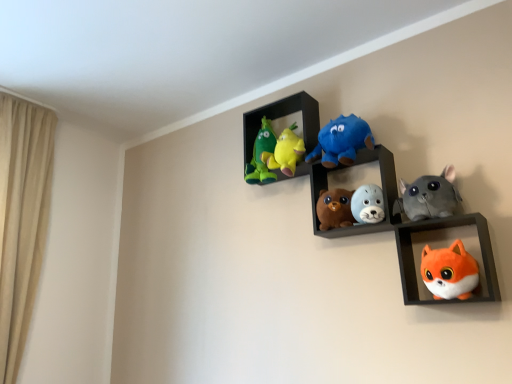
Question: Does fluffy gray seal at center, the 3th toy positioned from the right, appear on the left side of soft plush toys at center, arranged as the second shelf when viewed from the front?

Choices:
 (A) no
 (B) yes

Answer: (A)

Question: Can we say fluffy gray seal at center, the 3th toy positioned from the right, lies outside soft plush toys at center, arranged as the second shelf when viewed from the front?

Choices:
 (A) no
 (B) yes

Answer: (A)

Question: Does fluffy gray seal at center, the 3th toy positioned from the right, have a greater height compared to soft plush toys at center, which appears as the 1th shelf when viewed from the back?

Choices:
 (A) no
 (B) yes

Answer: (A)

Question: Would you say soft plush toys at center, which appears as the 1th shelf when viewed from the back, is part of fluffy gray seal at center, placed as the fourth toy when sorted from left to right,'s contents?

Choices:
 (A) no
 (B) yes

Answer: (A)

Question: Is fluffy gray seal at center, the 3th toy positioned from the right, at the right side of soft plush toys at center, which appears as the 1th shelf when viewed from the back?

Choices:
 (A) no
 (B) yes

Answer: (B)

Question: Is fluffy gray seal at center, the 3th toy positioned from the right, far from soft plush toys at center, arranged as the second shelf when viewed from the front?

Choices:
 (A) yes
 (B) no

Answer: (B)

Question: Is velvet plush toys at upper center placed right next to fluffy gray seal at center, placed as the fourth toy when sorted from left to right?

Choices:
 (A) no
 (B) yes

Answer: (A)

Question: Does velvet plush toys at upper center come in front of fluffy gray seal at center, placed as the fourth toy when sorted from left to right?

Choices:
 (A) yes
 (B) no

Answer: (B)

Question: From a real-world perspective, is velvet plush toys at upper center on top of fluffy gray seal at center, the 3th toy positioned from the right?

Choices:
 (A) yes
 (B) no

Answer: (A)

Question: Can you confirm if velvet plush toys at upper center is taller than fluffy gray seal at center, placed as the fourth toy when sorted from left to right?

Choices:
 (A) yes
 (B) no

Answer: (A)

Question: Is velvet plush toys at upper center not near fluffy gray seal at center, placed as the fourth toy when sorted from left to right?

Choices:
 (A) no
 (B) yes

Answer: (A)

Question: From the image's perspective, is velvet plush toys at upper center above fluffy gray seal at center, placed as the fourth toy when sorted from left to right?

Choices:
 (A) no
 (B) yes

Answer: (B)

Question: Can you confirm if soft plush toys at center, which appears as the 1th shelf when viewed from the back, is taller than fluffy gray seal at center, placed as the fourth toy when sorted from left to right?

Choices:
 (A) yes
 (B) no

Answer: (A)